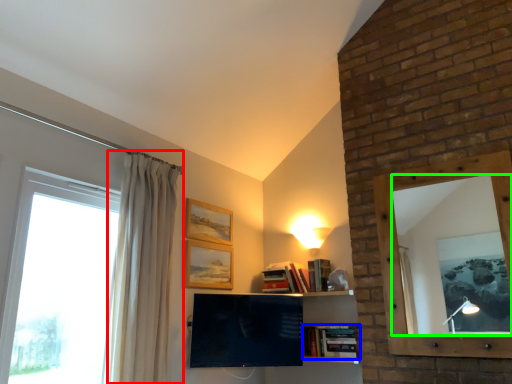
Question: Considering the real-world distances, which object is farthest from curtain (highlighted by a red box)? book (highlighted by a blue box) or mirror (highlighted by a green box)?

Choices:
 (A) book
 (B) mirror

Answer: (B)